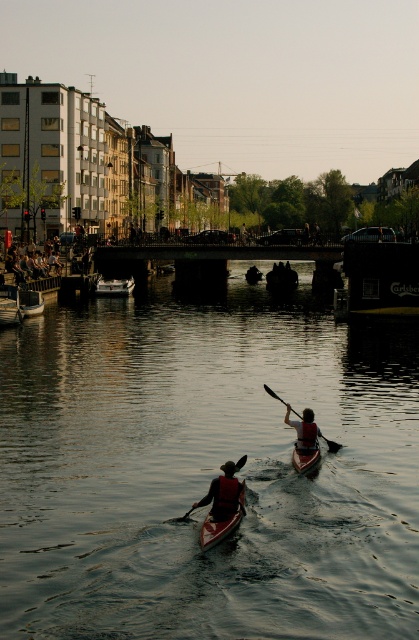
Question: Is white plastic boat at center below wooden canoe at left?

Choices:
 (A) no
 (B) yes

Answer: (A)

Question: Which of these objects is positioned farthest from the orange plastic canoe at center?

Choices:
 (A) silvery water at center
 (B) wooden canoe at left
 (C) wooden oars at center

Answer: (C)

Question: Can you confirm if silvery water at center is positioned to the right of wooden oars at center?

Choices:
 (A) yes
 (B) no

Answer: (A)

Question: Estimate the real-world distances between objects in this image. Which object is farther from the dark red life vest at center?

Choices:
 (A) red life jacket at center
 (B) black plastic paddle at center

Answer: (B)

Question: Which is nearer to the wooden oars at center?

Choices:
 (A) matte red canoe at center
 (B) dark red life vest at center
 (C) silvery water at center
 (D) orange plastic canoe at center

Answer: (C)

Question: Considering the relative positions of dark red life vest at center and matte red canoe at center in the image provided, where is dark red life vest at center located with respect to matte red canoe at center?

Choices:
 (A) right
 (B) left

Answer: (B)